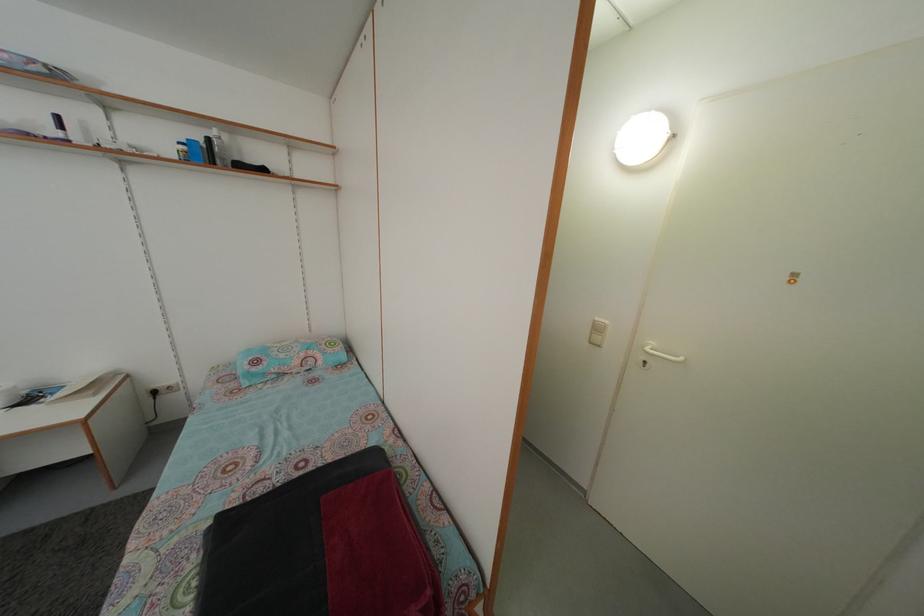
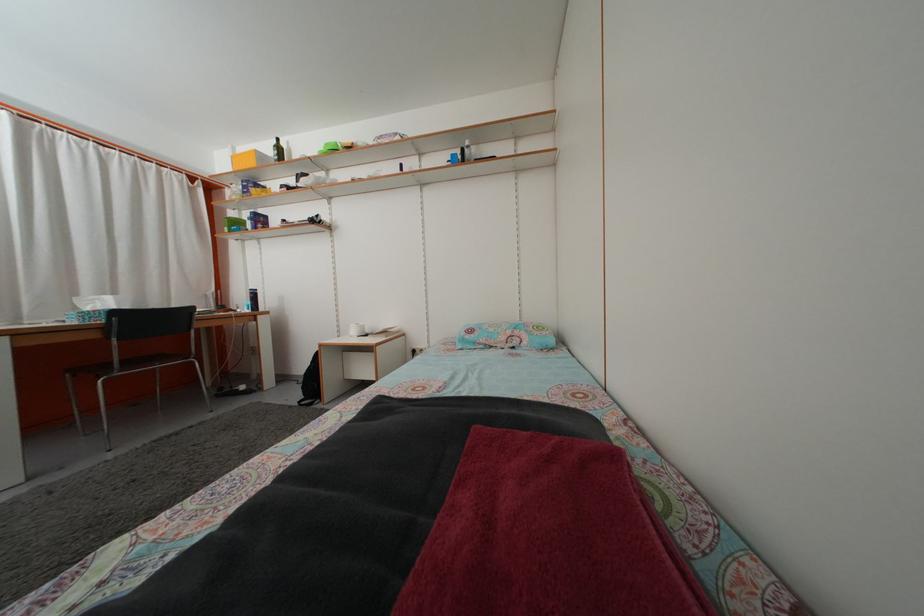
In the second image, find the point that corresponds to (304,369) in the first image.

(508, 346)